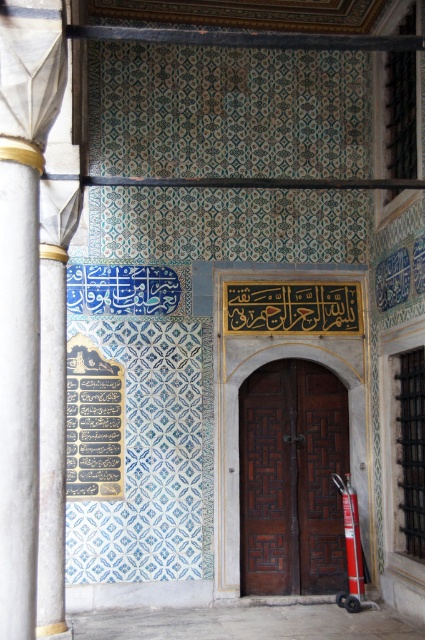
Is white marble column at left below brown wooden door at center?

Incorrect, white marble column at left is not positioned below brown wooden door at center.

Is white marble column at left positioned in front of brown wooden door at center?

Yes, white marble column at left is in front of brown wooden door at center.

Is point (11, 38) farther from viewer compared to point (319, 586)?

No, it is not.

You are a GUI agent. You are given a task and a screenshot of the screen. Output one action in this format:
    pyautogui.click(x=<x>, y=<y>)
    Task: Click on the white marble column at left
    The height and width of the screenshot is (640, 425).
    Given the screenshot: What is the action you would take?
    pyautogui.click(x=22, y=285)